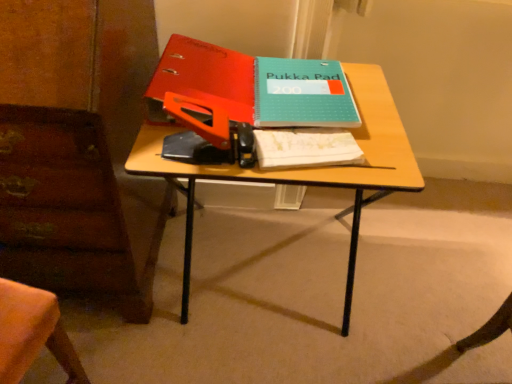
In order to click on vacant area that is in front of teal matte notebook at center, which ranks as the 1th paperback book in right-to-left order in this screenshot , I will do `click(323, 156)`.